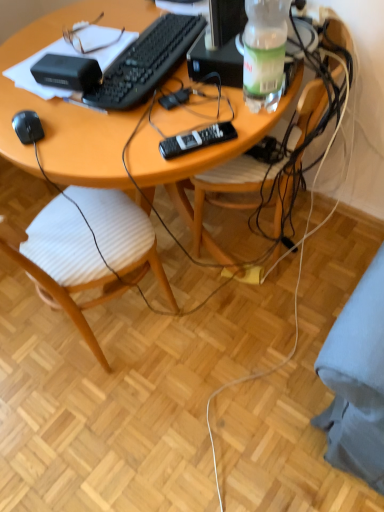
This screenshot has width=384, height=512. What are the coordinates of `free space above black matte keyboard at center (from a real-world perspective)` in the screenshot? It's located at 154,46.